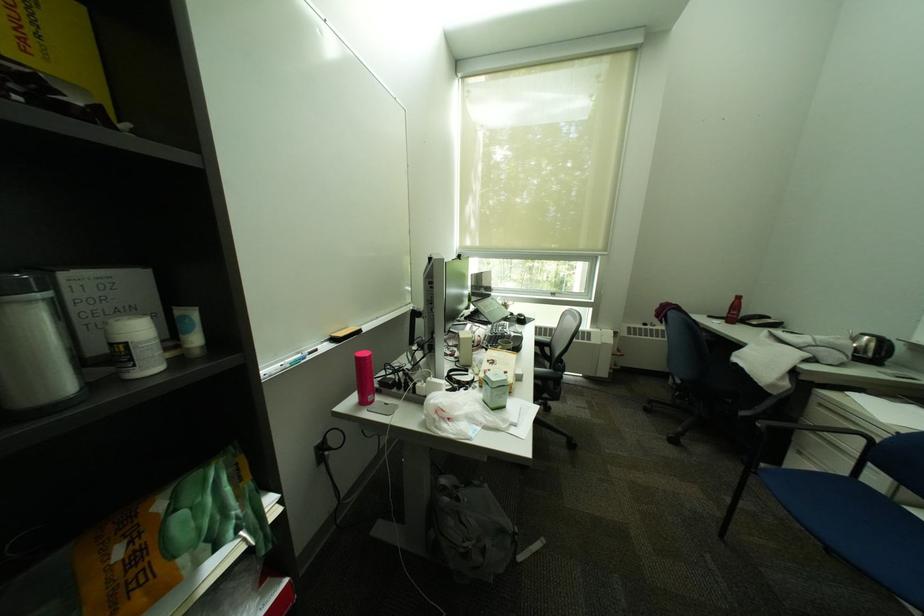
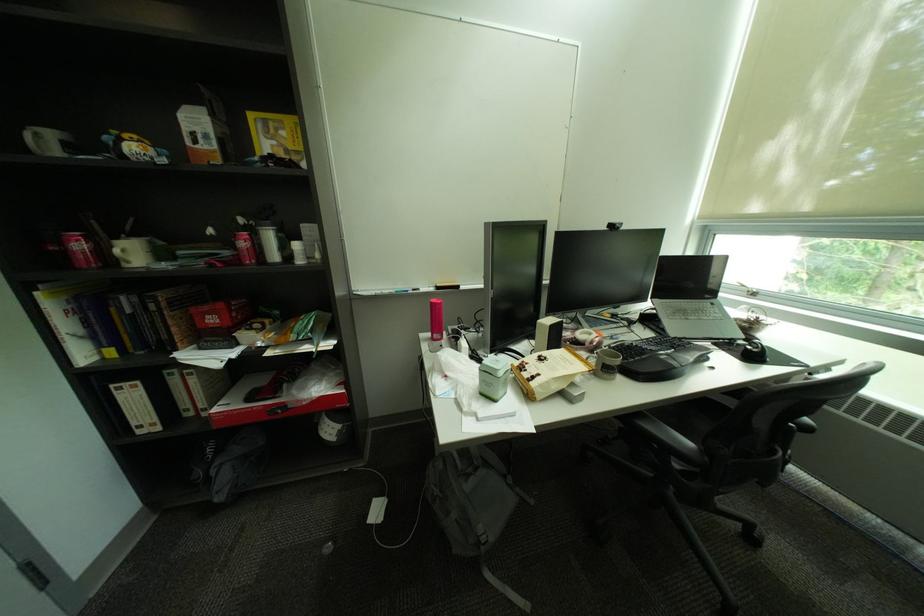
In the second image, find the point that corresponds to (x=504, y=411) in the first image.

(492, 395)